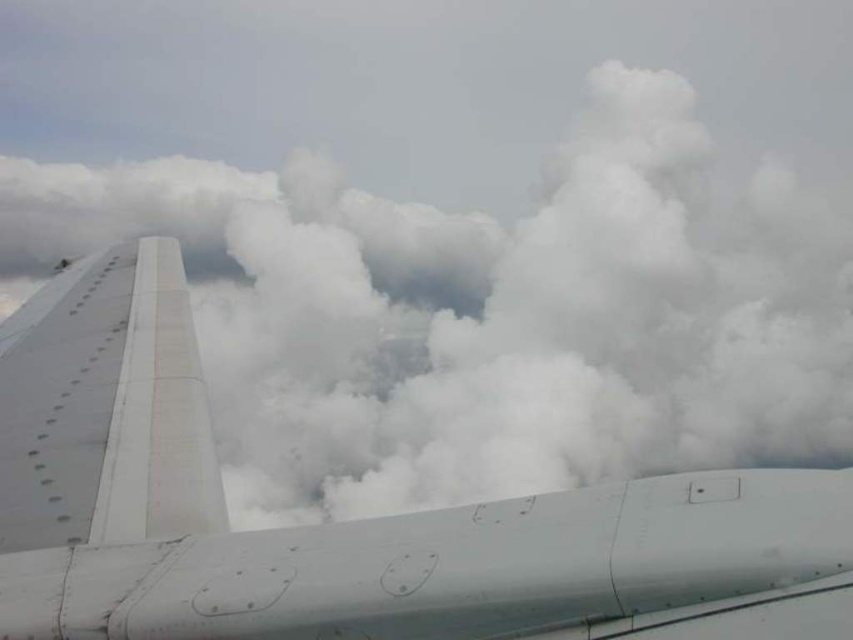
Question: Is white matte airplane wing at left to the left of white matte wing at left from the viewer's perspective?

Choices:
 (A) yes
 (B) no

Answer: (B)

Question: Can you confirm if white matte airplane wing at left is positioned to the left of white matte wing at left?

Choices:
 (A) yes
 (B) no

Answer: (B)

Question: Which object is closer to the camera taking this photo?

Choices:
 (A) white matte wing at left
 (B) white matte airplane wing at left

Answer: (B)

Question: Can you confirm if white matte airplane wing at left is wider than white matte wing at left?

Choices:
 (A) yes
 (B) no

Answer: (A)

Question: Which point appears farthest from the camera in this image?

Choices:
 (A) (177, 252)
 (B) (787, 624)

Answer: (A)